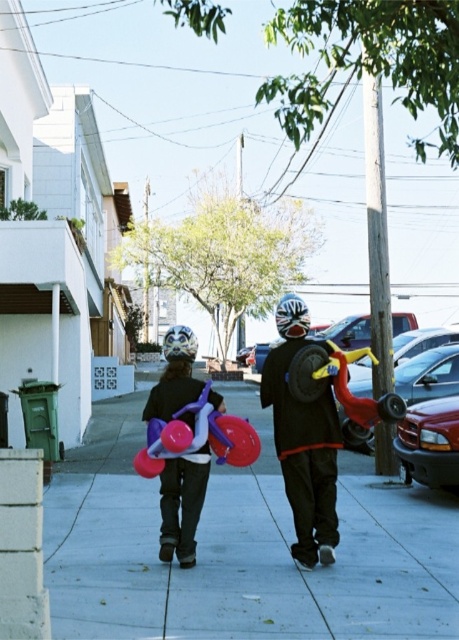
You are a photographer trying to capture both the white matte helmet at center and the shiny metallic helmet at center in a single shot. Which helmet will appear larger in the photo?

The white matte helmet at center will appear larger in the photo because it is closer to the viewer than the shiny metallic helmet at center.

You are a photographer trying to capture both the white matte helmet at center and the shiny metallic helmet at center in a single frame. Which helmet should you focus on first if you want to ensure both are in the shot?

The white matte helmet at center is positioned on the right side of the shiny metallic helmet at center, so you should focus on the shiny metallic helmet at center first to ensure both are in the frame.

You are a photographer trying to capture the matte purple balloon at center in your shot. The camera is positioned at the camera position. Based on the coordinates provided, can you determine if the balloon is in the frame?

The matte purple balloon at center is located at point (182, 504), which falls within the camera frame, so it is visible in the shot.